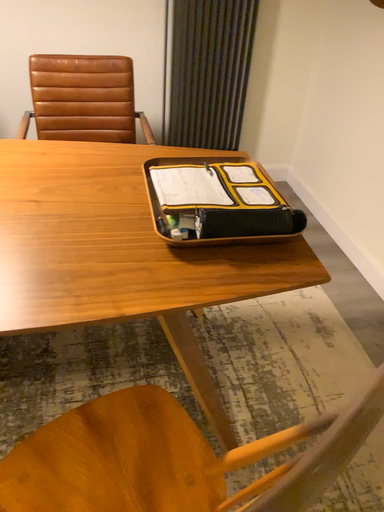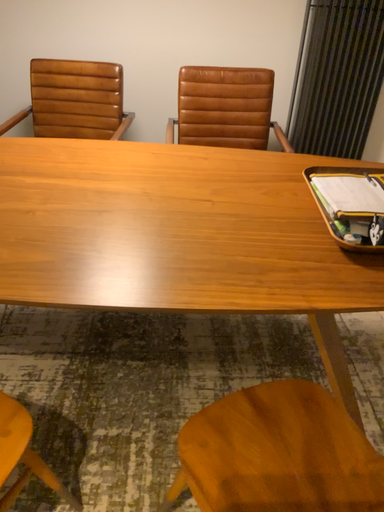
Question: How did the camera likely rotate when shooting the video?

Choices:
 (A) rotated left
 (B) rotated right

Answer: (A)